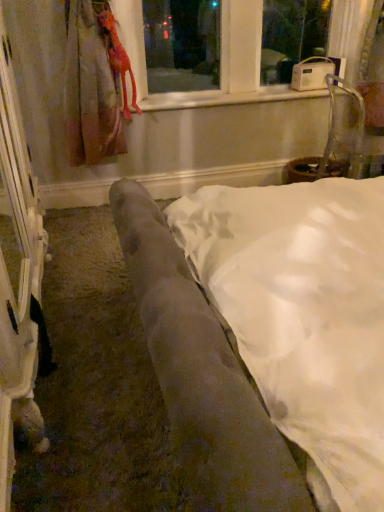
Question: Is velvet gray couch at center taller or shorter than rubber duck at upper left?

Choices:
 (A) short
 (B) tall

Answer: (A)

Question: Is velvet gray couch at center wider or thinner than rubber duck at upper left?

Choices:
 (A) wide
 (B) thin

Answer: (A)

Question: Which object is positioned farthest from the white plastic radio at upper center?

Choices:
 (A) velvet gray couch at center
 (B) rubber duck at upper left

Answer: (A)

Question: Considering the real-world distances, which object is closest to the white plastic radio at upper center?

Choices:
 (A) velvet gray couch at center
 (B) rubber duck at upper left

Answer: (B)